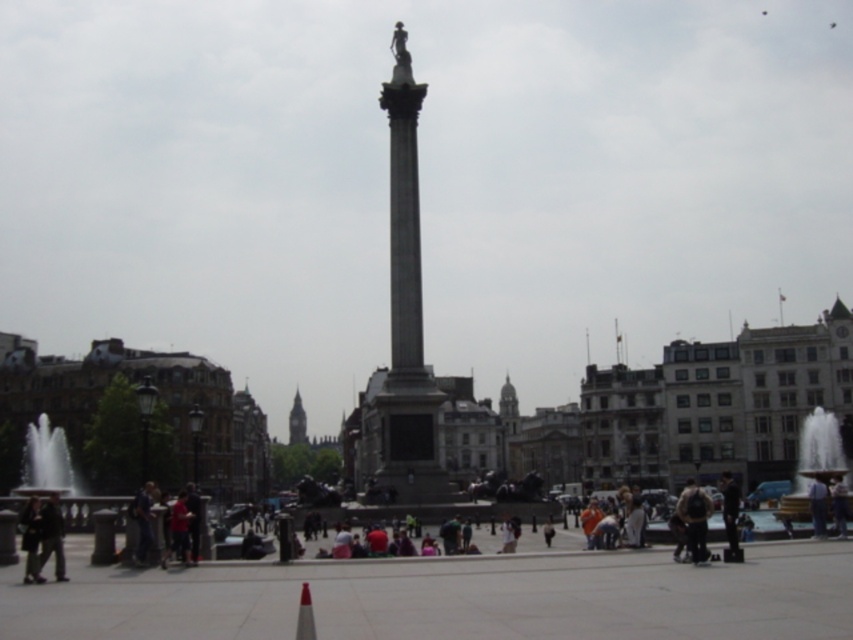
You are standing in the urban square and want to take a photo of the gray stone column at center without the dark brown leather jacket at lower left appearing in the frame. Which direction should you move to achieve this?

Move forward towards the gray stone column at center. Since the gray stone column at center is closer to you than the dark brown leather jacket at lower left, moving forward will reduce the distance to the column while the jacket remains behind, allowing you to frame the column without the jacket in the shot.

You are a pedestrian standing at the edge of the urban square. You see the blue jeans at lower right and the red plastic cone at lower center. Which object is closer to you?

The blue jeans at lower right are closer to you because the red plastic cone at lower center is behind them.

From the picture: You are an urban planner analyzing the square. You need to place a new statue that is the same size as the dark brown leather jacket at lower left. Can the base of the gray stone column at center accommodate it without overlapping?

The gray stone column at center is wider than the dark brown leather jacket at lower left. Therefore, the base of the gray stone column at center can accommodate a statue the size of the dark brown leather jacket at lower left without overlapping.